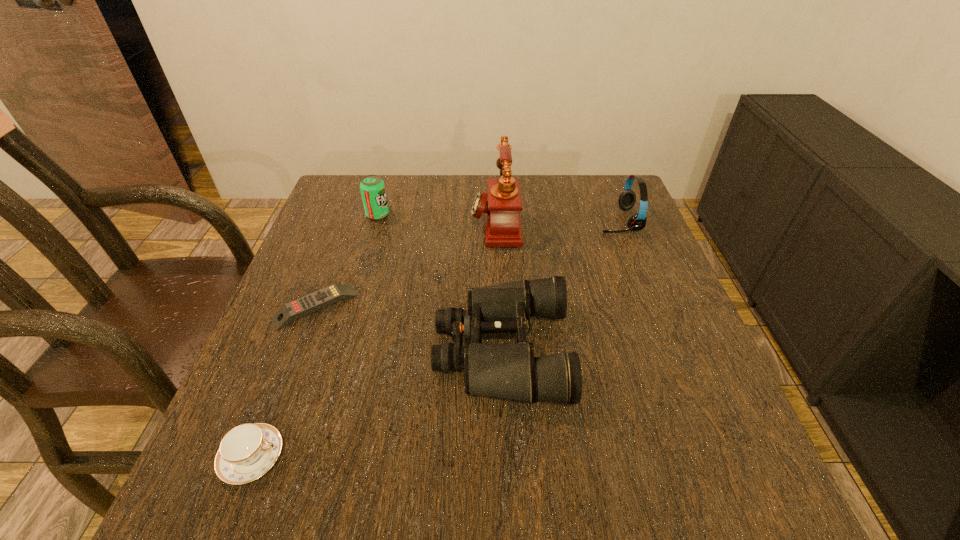
Where is `vacant space at the far edge of the desktop`? This screenshot has height=540, width=960. vacant space at the far edge of the desktop is located at coordinates (441, 175).

Locate an element on the screen. This screenshot has height=540, width=960. vacant space at the near edge of the desktop is located at coordinates (588, 482).

In the image, there is a desktop. Identify the location of vacant space at the right edge. (673, 313).

In the image, there is a desktop. Identify the location of vacant area at the far left corner. click(348, 202).

Where is `free space at the far right corner of the desktop`? The width and height of the screenshot is (960, 540). free space at the far right corner of the desktop is located at coordinates (599, 219).

Find the location of a particular element. The width and height of the screenshot is (960, 540). free space at the near right corner of the desktop is located at coordinates (744, 470).

Identify the location of free space between the rightmost object and the remote control. Image resolution: width=960 pixels, height=540 pixels. (467, 264).

Where is `vacant space in between the remote control and the telephone`? vacant space in between the remote control and the telephone is located at coordinates (405, 264).

In order to click on vacant area that lies between the rightmost object and the shortest object in this screenshot , I will do `click(467, 264)`.

Find the location of `free space between the nearest object and the third shortest object`. free space between the nearest object and the third shortest object is located at coordinates (377, 403).